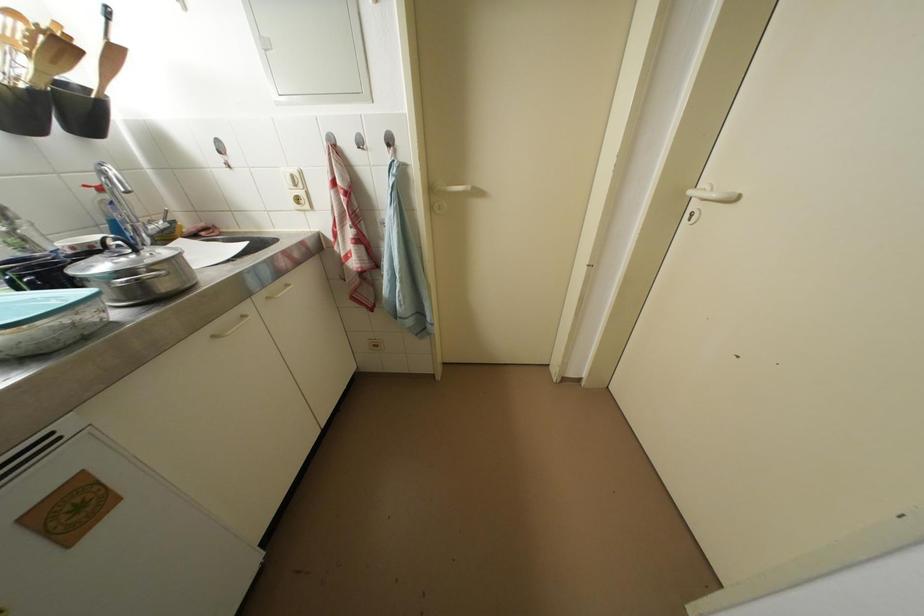
Describe the element at coordinates (161, 224) in the screenshot. The height and width of the screenshot is (616, 924). I see `the silver faucet handle` at that location.